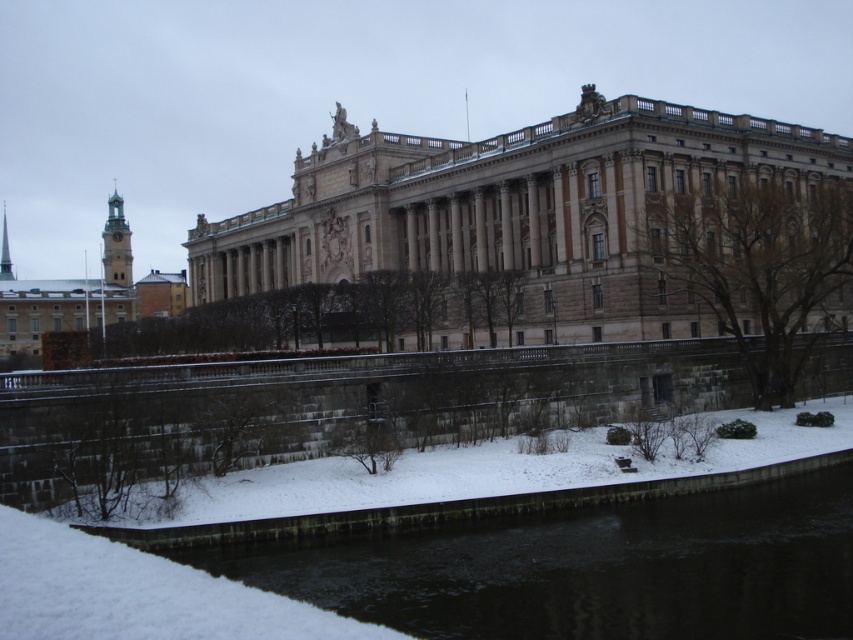
You are an architect analyzing the elevation of a winter scene. Given the beige stone palace at center and the black ice at lower left, which structure has a greater vertical height?

The beige stone palace at center is much taller than the black ice at lower left, so the palace has a greater vertical height.

You are an architect examining the building and its surroundings. You notice the black ice at lower left and the golden stone tower at left. Which of these two features is closer to the riverbank?

The black ice at lower left is closer to the riverbank because it is smaller than the golden stone tower at left, implying it is positioned nearer to the water.

You are standing on the riverbank looking at the beige stone palace at center and the golden stone tower at left. Which structure is positioned closer to your left side?

The golden stone tower at left is positioned closer to your left side since it is to the left of the beige stone palace at center.